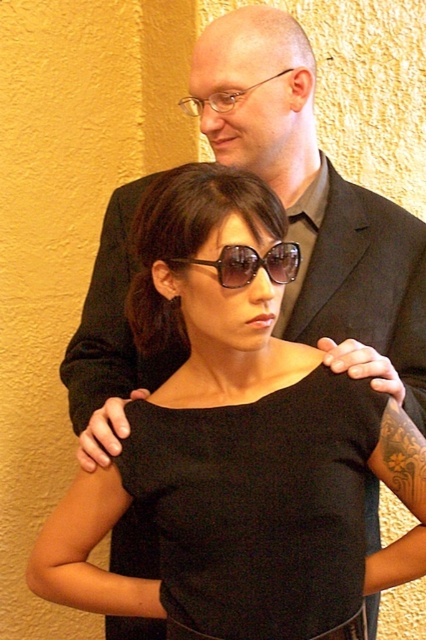
Measure the distance from black matte sunglasses at center to clear plastic glasses at upper center.

15.69 inches

Between black matte sunglasses at center and clear plastic glasses at upper center, which one is positioned lower?

black matte sunglasses at center

This screenshot has height=640, width=426. I want to click on black matte sunglasses at center, so click(x=365, y=285).

The height and width of the screenshot is (640, 426). In order to click on black matte sunglasses at center in this screenshot , I will do `click(365, 285)`.

Can you confirm if sunglasses at center is smaller than clear plastic glasses at upper center?

Yes, sunglasses at center is smaller than clear plastic glasses at upper center.

Does sunglasses at center have a larger size compared to clear plastic glasses at upper center?

Incorrect, sunglasses at center is not larger than clear plastic glasses at upper center.

Which is in front, point (212, 260) or point (213, 99)?

Point (212, 260)

The image size is (426, 640). What are the coordinates of `sunglasses at center` in the screenshot? It's located at (250, 262).

Is black matte dress at center to the right of clear plastic glasses at upper center from the viewer's perspective?

Yes, black matte dress at center is to the right of clear plastic glasses at upper center.

Who is taller, black matte dress at center or clear plastic glasses at upper center?

black matte dress at center

What are the coordinates of `black matte dress at center` in the screenshot? It's located at (259, 506).